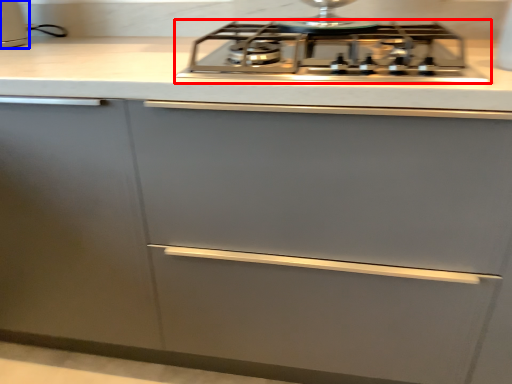
Question: Among these objects, which one is farthest to the camera, gas stove (highlighted by a red box) or kitchen appliance (highlighted by a blue box)?

Choices:
 (A) gas stove
 (B) kitchen appliance

Answer: (B)